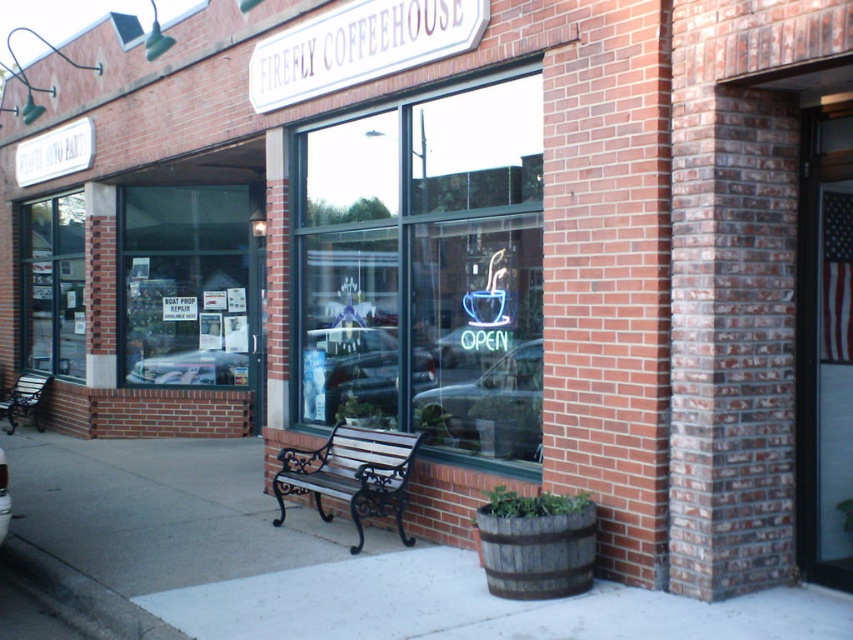
You are a delivery person trying to find the entrance to Firefly Coffeehouse. You see the neon glass window at center and the wooden park bench at lower left. Which object is bigger and can help you identify the entrance?

The neon glass window at center is larger in size than the wooden park bench at lower left, so the larger neon glass window at center is more likely to indicate the entrance as it is prominent and central.